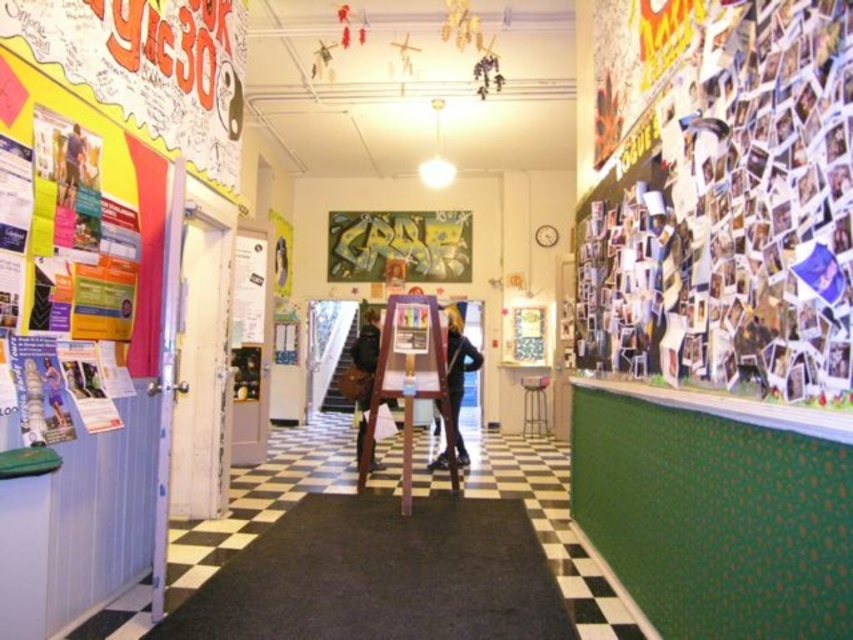
You are standing in the hallway and need to locate the point at coordinates (399, 244). According to the scene description, where exactly is this point located?

The point at coordinates (399, 244) is on the green matte poster at center.

You are a visitor entering the hallway and see the green matte poster at center and the black leather pants at center. Which object is positioned higher up in the scene?

The green matte poster at center is positioned higher up than the black leather pants at center.